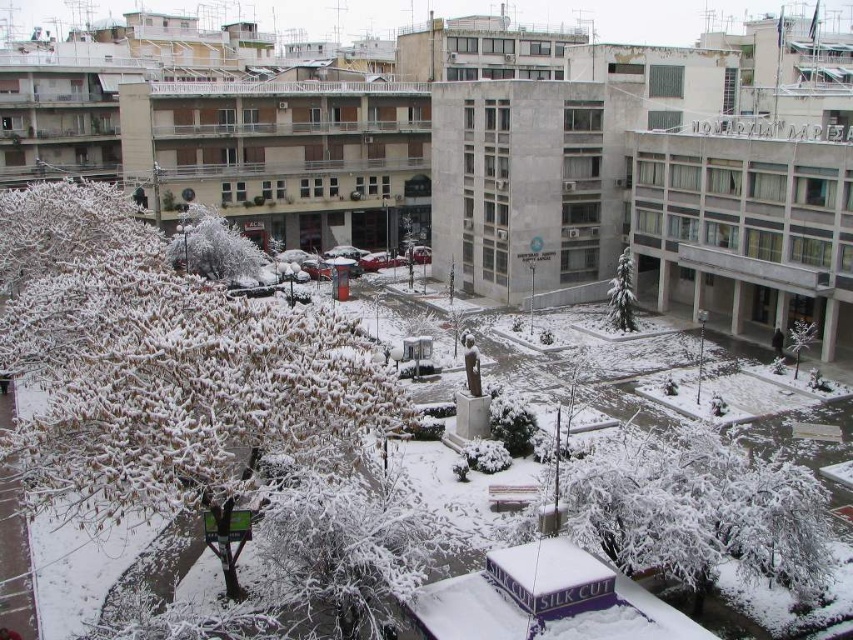
You are standing on a balcony overlooking the snowy park. You notice two trees at the center of the park, the green matte tree at center and the white frosted tree at center. Which tree is closer to you?

The green matte tree at center is closer to you since the white frosted tree at center is positioned behind it.